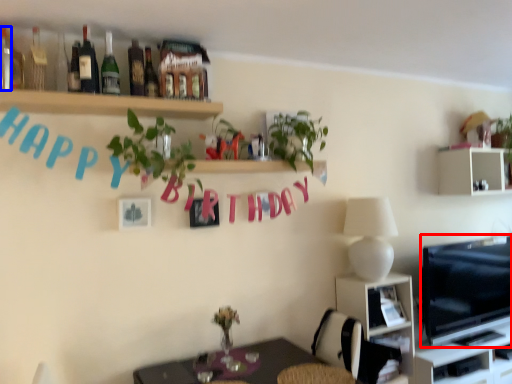
Question: Which point is further to the camera, television (highlighted by a red box) or bottle (highlighted by a blue box)?

Choices:
 (A) television
 (B) bottle

Answer: (A)